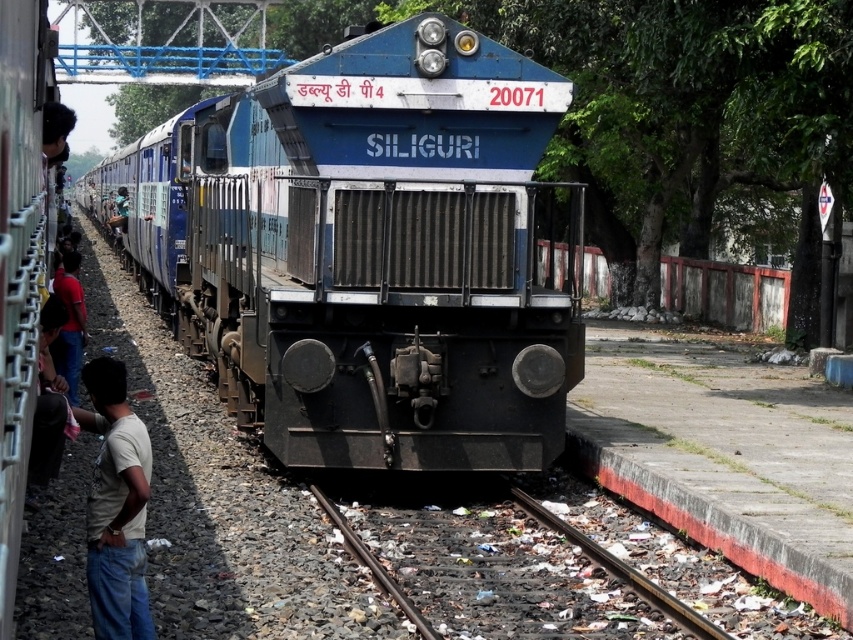
Question: Among these objects, which one is farthest from the camera?

Choices:
 (A) dark blue shirt at left
 (B) light beige t-shirt at lower left
 (C) dark blue jeans at left

Answer: (C)

Question: Which point appears farthest from the camera in this image?

Choices:
 (A) (322, 497)
 (B) (51, 476)

Answer: (A)

Question: Is dark blue shirt at left to the left of dark blue jeans at left from the viewer's perspective?

Choices:
 (A) no
 (B) yes

Answer: (A)

Question: Among these points, which one is nearest to the camera?

Choices:
 (A) (119, 196)
 (B) (503, 177)
 (C) (77, 346)
 (D) (42, 388)

Answer: (D)

Question: Can you confirm if dark blue shirt at left is thinner than blue fabric shirt at left?

Choices:
 (A) no
 (B) yes

Answer: (B)

Question: Is dark blue shirt at left to the right of dark blue jeans at left from the viewer's perspective?

Choices:
 (A) yes
 (B) no

Answer: (A)